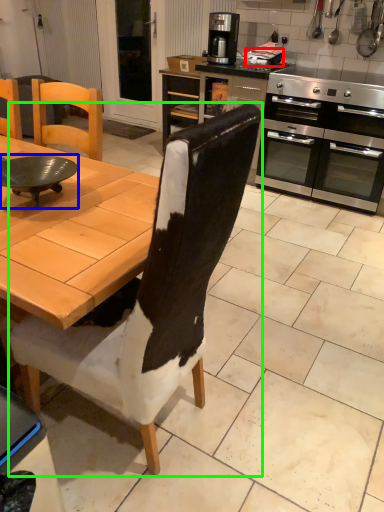
Question: Which is nearer to the appliance (highlighted by a red box)? round table (highlighted by a blue box) or chair (highlighted by a green box).

Choices:
 (A) round table
 (B) chair

Answer: (A)